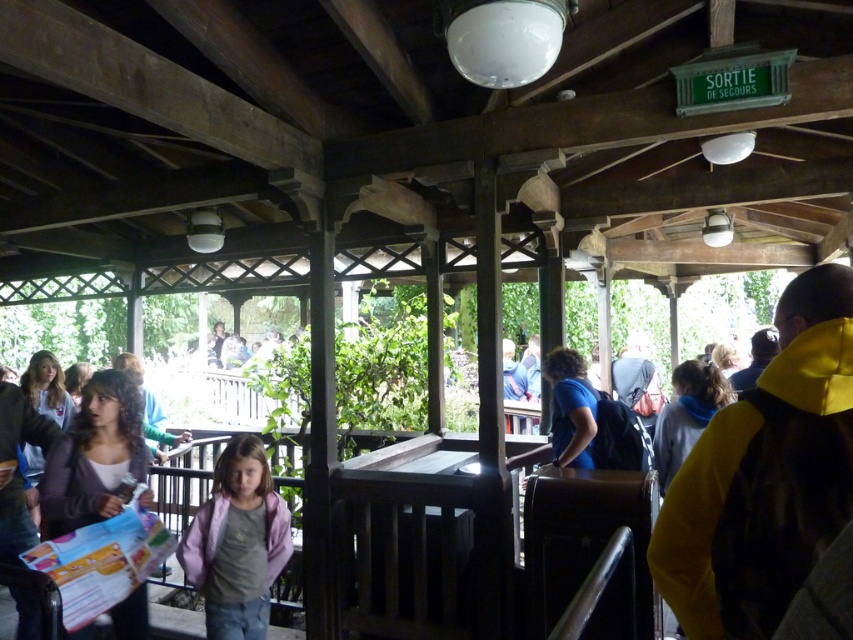
Does yellow fleece jacket at right have a lesser width compared to gray fleece jacket at center?

Indeed, yellow fleece jacket at right has a lesser width compared to gray fleece jacket at center.

Can you confirm if yellow fleece jacket at right is positioned to the right of gray fleece jacket at center?

No, yellow fleece jacket at right is not to the right of gray fleece jacket at center.

This screenshot has height=640, width=853. What are the coordinates of `yellow fleece jacket at right` in the screenshot? It's located at (764, 476).

Does pink fabric jacket at center appear on the left side of matte gray sweater at left?

No, pink fabric jacket at center is not to the left of matte gray sweater at left.

Does pink fabric jacket at center have a greater height compared to matte gray sweater at left?

Correct, pink fabric jacket at center is much taller as matte gray sweater at left.

Find the location of a particular element. Image resolution: width=853 pixels, height=640 pixels. pink fabric jacket at center is located at coordinates (236, 541).

In the scene shown: Can you confirm if matte gray sweater at left is smaller than gray fleece jacket at center?

Yes, matte gray sweater at left is smaller than gray fleece jacket at center.

The width and height of the screenshot is (853, 640). What do you see at coordinates (94, 456) in the screenshot? I see `matte gray sweater at left` at bounding box center [94, 456].

Locate an element on the screen. matte gray sweater at left is located at coordinates (94, 456).